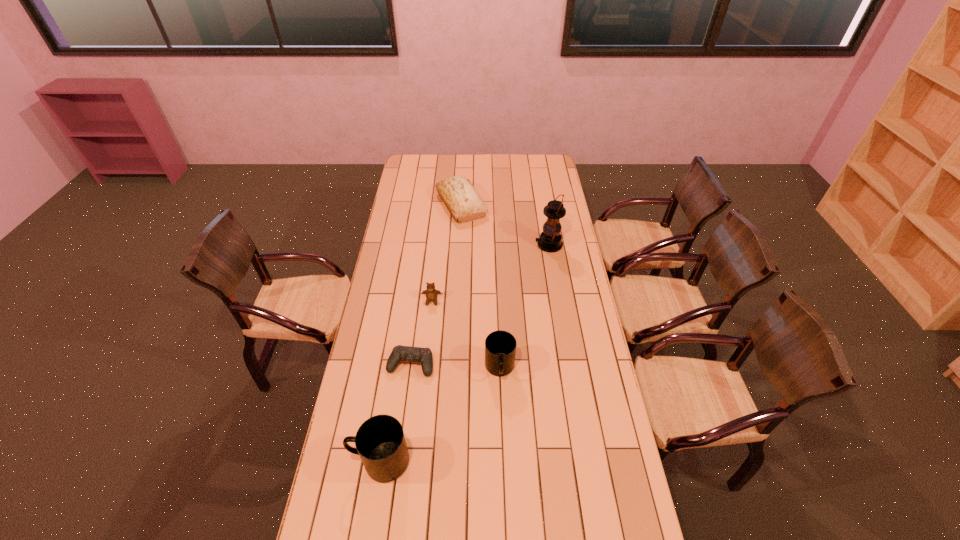
Where is `vacant space at the far edge`? This screenshot has width=960, height=540. vacant space at the far edge is located at coordinates (513, 165).

In the image, there is a desktop. At what (x,y) coordinates should I click in order to perform the action: click on vacant space at the near edge. Please return your answer as a coordinate pair (x, y). The width and height of the screenshot is (960, 540). Looking at the image, I should click on (523, 509).

The height and width of the screenshot is (540, 960). In the image, there is a desktop. What are the coordinates of `vacant space at the left edge` in the screenshot? It's located at (392, 308).

The width and height of the screenshot is (960, 540). Identify the location of free space at the right edge of the desktop. (x=565, y=305).

The height and width of the screenshot is (540, 960). In the image, there is a desktop. Identify the location of free space at the near right corner. (636, 518).

The width and height of the screenshot is (960, 540). I want to click on free space between the control and the shorter mug, so click(x=455, y=367).

Find the location of a particular element. free space between the farthest object and the control is located at coordinates pos(436,285).

You are a GUI agent. You are given a task and a screenshot of the screen. Output one action in this format:
    pyautogui.click(x=<x>, y=<y>)
    Task: Click on the vacant region between the farthest object and the nearest object
    The image size is (960, 540).
    Given the screenshot: What is the action you would take?
    pyautogui.click(x=420, y=333)

Locate an element on the screen. The height and width of the screenshot is (540, 960). free point between the tallest object and the shorter mug is located at coordinates (524, 307).

At what (x,y) coordinates should I click in order to perform the action: click on unoccupied area between the shortest object and the left mug. Please return your answer as a coordinate pair (x, y). The height and width of the screenshot is (540, 960). Looking at the image, I should click on (396, 413).